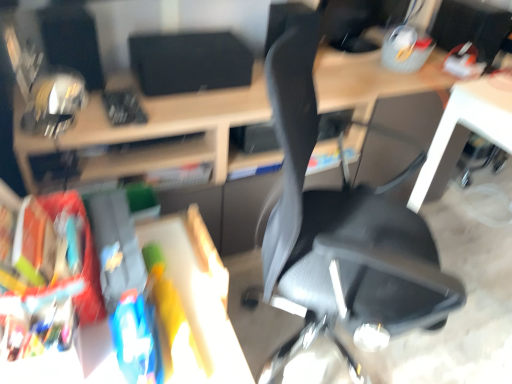
The width and height of the screenshot is (512, 384). What do you see at coordinates (341, 233) in the screenshot?
I see `black mesh chair at center` at bounding box center [341, 233].

At what (x,y) coordinates should I click in order to perform the action: click on black matte speaker at upper center, the first computer monitor from the left. Please return your answer as a coordinate pair (x, y). The width and height of the screenshot is (512, 384). Looking at the image, I should click on (189, 62).

This screenshot has width=512, height=384. Find the location of `black mesh chair at center`. black mesh chair at center is located at coordinates (341, 233).

From the image's perspective, who appears lower, black mesh chair at center or matte black monitor at upper right, which is the first computer monitor from right to left?

black mesh chair at center.

Image resolution: width=512 pixels, height=384 pixels. Find the location of `chair located below the matte black monitor at upper right, which is the first computer monitor from right to left (from the image's perspective)`. chair located below the matte black monitor at upper right, which is the first computer monitor from right to left (from the image's perspective) is located at coordinates [341, 233].

From a real-world perspective, is black mesh chair at center physically located above or below matte black monitor at upper right, which is counted as the second computer monitor, starting from the left?

In terms of real-world spatial position, black mesh chair at center is below matte black monitor at upper right, which is counted as the second computer monitor, starting from the left.

Would you say black mesh chair at center is outside matte black monitor at upper right, which is the first computer monitor from right to left?

black mesh chair at center is positioned outside matte black monitor at upper right, which is the first computer monitor from right to left.

Is matte black monitor at upper right, which is the first computer monitor from right to left, at the back of black matte speaker at upper center, which is the 2th computer monitor from right to left?

No.

Considering the positions of objects black matte speaker at upper center, which is the 2th computer monitor from right to left, and matte black monitor at upper right, which is counted as the second computer monitor, starting from the left, in the image provided, who is more to the left, black matte speaker at upper center, which is the 2th computer monitor from right to left, or matte black monitor at upper right, which is counted as the second computer monitor, starting from the left,?

From the viewer's perspective, black matte speaker at upper center, which is the 2th computer monitor from right to left, appears more on the left side.

Does point (158, 63) come in front of point (352, 47)?

Yes, it is.

Can you confirm if black matte speaker at upper center, which is the 2th computer monitor from right to left, is taller than matte black monitor at upper right, which is the first computer monitor from right to left?

In fact, black matte speaker at upper center, which is the 2th computer monitor from right to left, may be shorter than matte black monitor at upper right, which is the first computer monitor from right to left.

How distant is black mesh chair at center from black matte speaker at upper center, which is the 2th computer monitor from right to left?

A: black mesh chair at center is 61.24 centimeters from black matte speaker at upper center, which is the 2th computer monitor from right to left.

Is black mesh chair at center wider or thinner than black matte speaker at upper center, the first computer monitor from the left?

Considering their sizes, black mesh chair at center looks broader than black matte speaker at upper center, the first computer monitor from the left.

Consider the image. Based on their positions, is black mesh chair at center located to the left or right of black matte speaker at upper center, the first computer monitor from the left?

Clearly, black mesh chair at center is on the right of black matte speaker at upper center, the first computer monitor from the left, in the image.

From a real-world perspective, is black mesh chair at center physically located above or below black matte speaker at upper center, which is the 2th computer monitor from right to left?

From a real-world perspective, black mesh chair at center is physically below black matte speaker at upper center, which is the 2th computer monitor from right to left.

In the scene shown: From the image's perspective, which is below, matte black monitor at upper right, which is counted as the second computer monitor, starting from the left, or black matte speaker at upper center, which is the 2th computer monitor from right to left?

black matte speaker at upper center, which is the 2th computer monitor from right to left.

Which is nearer, [372,47] or [151,63]?

Clearly, point [372,47] is more distant from the camera than point [151,63].

From a real-world perspective, is matte black monitor at upper right, which is counted as the second computer monitor, starting from the left, under black matte speaker at upper center, which is the 2th computer monitor from right to left?

No, from a real-world perspective, matte black monitor at upper right, which is counted as the second computer monitor, starting from the left, is not below black matte speaker at upper center, which is the 2th computer monitor from right to left.

From a real-world perspective, starting from the matte black desk at center, which computer monitor is the 2nd one vertically above it? Please provide its 2D coordinates.

[(357, 21)]

Looking at this image, from the image's perspective, is matte black monitor at upper right, which is counted as the second computer monitor, starting from the left, above or below matte black desk at center?

Clearly, from the image's perspective, matte black monitor at upper right, which is counted as the second computer monitor, starting from the left, is above matte black desk at center.

Are matte black monitor at upper right, which is counted as the second computer monitor, starting from the left, and matte black desk at center making contact?

There is a gap between matte black monitor at upper right, which is counted as the second computer monitor, starting from the left, and matte black desk at center.

Measure the distance from matte black monitor at upper right, which is counted as the second computer monitor, starting from the left, to matte black desk at center.

56.83 centimeters.

Measure the distance between matte black desk at center and black matte speaker at upper center, which is the 2th computer monitor from right to left.

6.36 inches.

From the image's perspective, between matte black desk at center and black matte speaker at upper center, the first computer monitor from the left, who is located below?

matte black desk at center appears lower in the image.

From a real-world perspective, which computer monitor is the 1st one above the matte black desk at center? Please provide its 2D coordinates.

[(189, 62)]

Is matte black desk at center further to camera compared to black matte speaker at upper center, which is the 2th computer monitor from right to left?

No.

Which is in front, black matte speaker at upper center, which is the 2th computer monitor from right to left, or black mesh chair at center?

black mesh chair at center is closer to the camera.

Would you consider black matte speaker at upper center, the first computer monitor from the left, to be distant from black mesh chair at center?

No, black matte speaker at upper center, the first computer monitor from the left, is not far from black mesh chair at center.

In the scene shown: Is black matte speaker at upper center, which is the 2th computer monitor from right to left, bigger or smaller than black mesh chair at center?

Clearly, black matte speaker at upper center, which is the 2th computer monitor from right to left, is smaller in size than black mesh chair at center.

In the scene shown: Is black matte speaker at upper center, which is the 2th computer monitor from right to left, turned away from black mesh chair at center?

No.

The height and width of the screenshot is (384, 512). I want to click on computer monitor that is the 2nd object located above the black mesh chair at center (from the image's perspective), so click(x=357, y=21).

Locate an element on the screen. This screenshot has width=512, height=384. computer monitor on the left of matte black monitor at upper right, which is counted as the second computer monitor, starting from the left is located at coordinates (189, 62).

Looking at the image, which one is located further to matte black monitor at upper right, which is counted as the second computer monitor, starting from the left, black matte speaker at upper center, the first computer monitor from the left, or matte black desk at center?

matte black desk at center is positioned further to the anchor matte black monitor at upper right, which is counted as the second computer monitor, starting from the left.

Which object lies nearer to the anchor point black matte speaker at upper center, which is the 2th computer monitor from right to left, black mesh chair at center or matte black desk at center?

matte black desk at center lies closer to black matte speaker at upper center, which is the 2th computer monitor from right to left, than the other object.

Considering their positions, is matte black monitor at upper right, which is the first computer monitor from right to left, positioned further to black mesh chair at center than black matte speaker at upper center, which is the 2th computer monitor from right to left?

matte black monitor at upper right, which is the first computer monitor from right to left, is further to black mesh chair at center.

From the image, which object appears to be nearer to black mesh chair at center, matte black desk at center or black matte speaker at upper center, which is the 2th computer monitor from right to left?

matte black desk at center is closer to black mesh chair at center.

From the image, which object appears to be farther from black mesh chair at center, matte black monitor at upper right, which is the first computer monitor from right to left, or matte black desk at center?

matte black monitor at upper right, which is the first computer monitor from right to left, is further to black mesh chair at center.

Estimate the real-world distances between objects in this image. Which object is closer to matte black monitor at upper right, which is the first computer monitor from right to left, black matte speaker at upper center, the first computer monitor from the left, or black mesh chair at center?

The object closer to matte black monitor at upper right, which is the first computer monitor from right to left, is black matte speaker at upper center, the first computer monitor from the left.

Based on their spatial positions, is black mesh chair at center or matte black desk at center further from matte black monitor at upper right, which is counted as the second computer monitor, starting from the left?

black mesh chair at center.

When comparing their distances from black mesh chair at center, does black matte speaker at upper center, the first computer monitor from the left, or matte black monitor at upper right, which is counted as the second computer monitor, starting from the left, seem closer?

black matte speaker at upper center, the first computer monitor from the left, is positioned closer to the anchor black mesh chair at center.

Locate an element on the screen. This screenshot has height=384, width=512. desk between black matte speaker at upper center, which is the 2th computer monitor from right to left, and matte black monitor at upper right, which is the first computer monitor from right to left is located at coordinates (174, 130).

At what (x,y) coordinates should I click in order to perform the action: click on computer monitor between black mesh chair at center and matte black monitor at upper right, which is the first computer monitor from right to left, in the front-back direction. Please return your answer as a coordinate pair (x, y). Looking at the image, I should click on pos(189,62).

The image size is (512, 384). I want to click on desk located between black mesh chair at center and black matte speaker at upper center, which is the 2th computer monitor from right to left, in the depth direction, so click(174, 130).

The image size is (512, 384). Find the location of `desk positioned between black mesh chair at center and matte black monitor at upper right, which is counted as the second computer monitor, starting from the left, from near to far`. desk positioned between black mesh chair at center and matte black monitor at upper right, which is counted as the second computer monitor, starting from the left, from near to far is located at coordinates (174, 130).